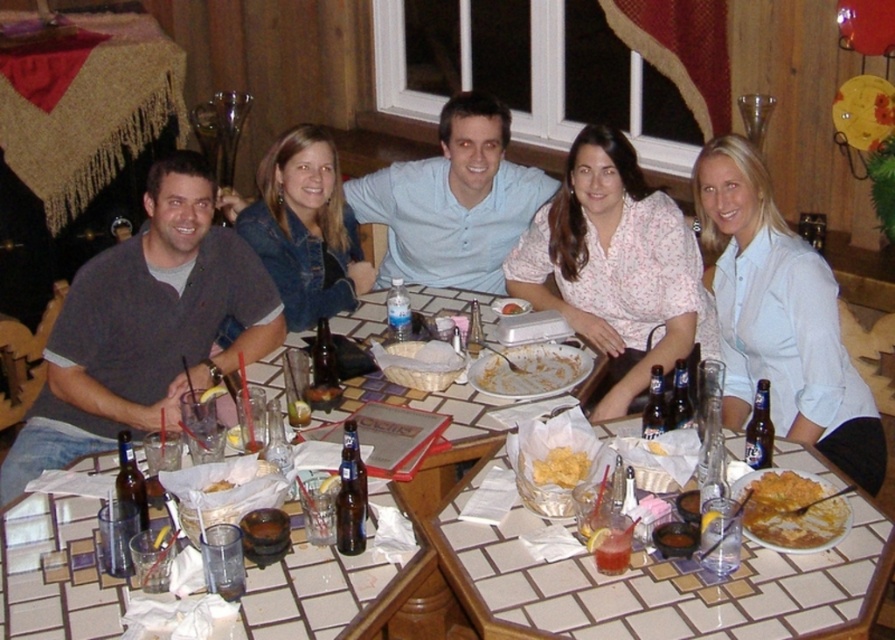
You are a waiter in a restaurant. You see the clear glass water at center. Can you reach it from your current position without moving your chair?

The clear glass water at center is 1.85 meters away from viewer. Since the typical reach distance for a person is about 1.5 meters, the waiter cannot reach the clear glass water at center without moving their chair.